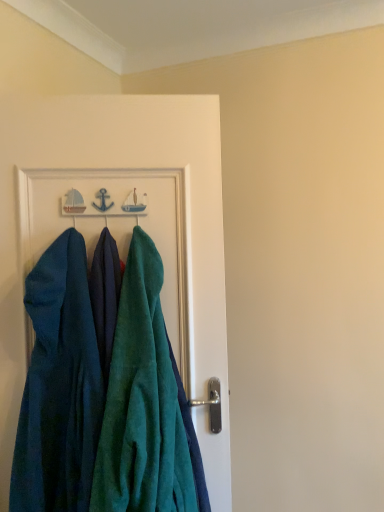
Question: Is teal velvety towel at center shorter than teal towel at center?

Choices:
 (A) yes
 (B) no

Answer: (A)

Question: Is teal velvety towel at center positioned behind teal towel at center?

Choices:
 (A) yes
 (B) no

Answer: (B)

Question: Is teal velvety towel at center positioned with its back to teal towel at center?

Choices:
 (A) no
 (B) yes

Answer: (B)

Question: Is teal velvety towel at center bigger than teal towel at center?

Choices:
 (A) no
 (B) yes

Answer: (A)

Question: Would you say teal velvety towel at center contains teal towel at center?

Choices:
 (A) yes
 (B) no

Answer: (B)

Question: Considering the relative positions of teal velvety dress at left and teal towel at center in the image provided, is teal velvety dress at left to the left or to the right of teal towel at center?

Choices:
 (A) right
 (B) left

Answer: (B)

Question: In the image, is teal velvety dress at left positioned in front of or behind teal towel at center?

Choices:
 (A) behind
 (B) front

Answer: (B)

Question: Is teal velvety dress at left taller or shorter than teal towel at center?

Choices:
 (A) short
 (B) tall

Answer: (A)

Question: Is point (77, 271) closer or farther from the camera than point (59, 161)?

Choices:
 (A) farther
 (B) closer

Answer: (B)

Question: In terms of size, does teal velvety dress at left appear bigger or smaller than teal velvety towel at center?

Choices:
 (A) big
 (B) small

Answer: (B)

Question: Relative to teal velvety towel at center, is teal velvety dress at left in front or behind?

Choices:
 (A) front
 (B) behind

Answer: (B)

Question: Considering the positions of teal velvety dress at left and teal velvety towel at center in the image, is teal velvety dress at left wider or thinner than teal velvety towel at center?

Choices:
 (A) thin
 (B) wide

Answer: (A)

Question: Based on their positions, is teal velvety dress at left located to the left or right of teal velvety towel at center?

Choices:
 (A) left
 (B) right

Answer: (A)

Question: Is teal velvety towel at center to the left or to the right of teal velvety dress at left in the image?

Choices:
 (A) left
 (B) right

Answer: (B)

Question: From their relative heights in the image, would you say teal velvety towel at center is taller or shorter than teal velvety dress at left?

Choices:
 (A) tall
 (B) short

Answer: (A)